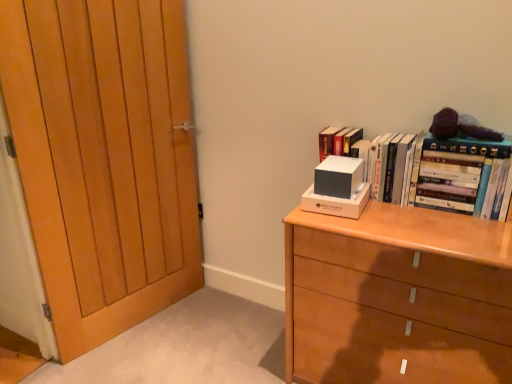
Image resolution: width=512 pixels, height=384 pixels. What are the coordinates of `wooden door at left` in the screenshot? It's located at (104, 158).

This screenshot has height=384, width=512. What do you see at coordinates (104, 158) in the screenshot? I see `wooden door at left` at bounding box center [104, 158].

Find the location of `wooden door at left`. wooden door at left is located at coordinates (104, 158).